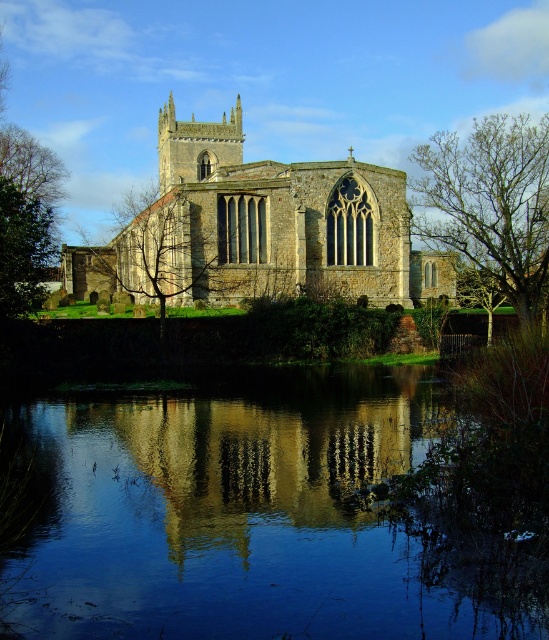
Can you confirm if transparent glass water at center is taller than green leafy tree at center?

Incorrect, transparent glass water at center's height is not larger of green leafy tree at center's.

Looking at this image, which of these two, transparent glass water at center or green leafy tree at center, stands shorter?

With less height is transparent glass water at center.

I want to click on transparent glass water at center, so [x=251, y=516].

You are a GUI agent. You are given a task and a screenshot of the screen. Output one action in this format:
    pyautogui.click(x=<x>, y=<y>)
    Task: Click on the transparent glass water at center
    
    Given the screenshot: What is the action you would take?
    pyautogui.click(x=251, y=516)

Does transparent glass water at center appear on the right side of stone church at center?

Indeed, transparent glass water at center is positioned on the right side of stone church at center.

Which is behind, point (194, 634) or point (389, 170)?

The point (389, 170) is behind.

The image size is (549, 640). Identify the location of transparent glass water at center. (251, 516).

The image size is (549, 640). What do you see at coordinates (490, 202) in the screenshot?
I see `bare wood tree at right` at bounding box center [490, 202].

Is point (495, 237) more distant than point (163, 221)?

Yes, point (495, 237) is behind point (163, 221).

Identify the location of bare wood tree at right. (490, 202).